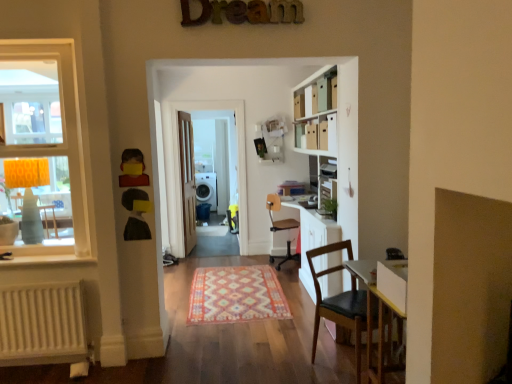
Question: From the image's perspective, is multicolored woven rug at center located above or below wooden at center, which ranks as the second chair in front-to-back order?

Choices:
 (A) above
 (B) below

Answer: (B)

Question: From a real-world perspective, relative to wooden at center, which ranks as the second chair in front-to-back order, is multicolored woven rug at center vertically above or below?

Choices:
 (A) above
 (B) below

Answer: (B)

Question: Which is farther from the matte yellow lampshade at left?

Choices:
 (A) brown leather chair at lower right, the first chair positioned from the front
 (B) orange fabric lampshade at left
 (C) multicolored woven rug at center
 (D) white plastic speaker at center
 (E) matte yellow toy at left

Answer: (D)

Question: Which of these objects is positioned closest to the matte yellow toy at left?

Choices:
 (A) white matte bookcase at center
 (B) brown leather chair at lower right, arranged as the 2th chair when viewed from the back
 (C) orange fabric lampshade at left
 (D) light brown wooden door at center
 (E) white matte radiator at lower left

Answer: (C)